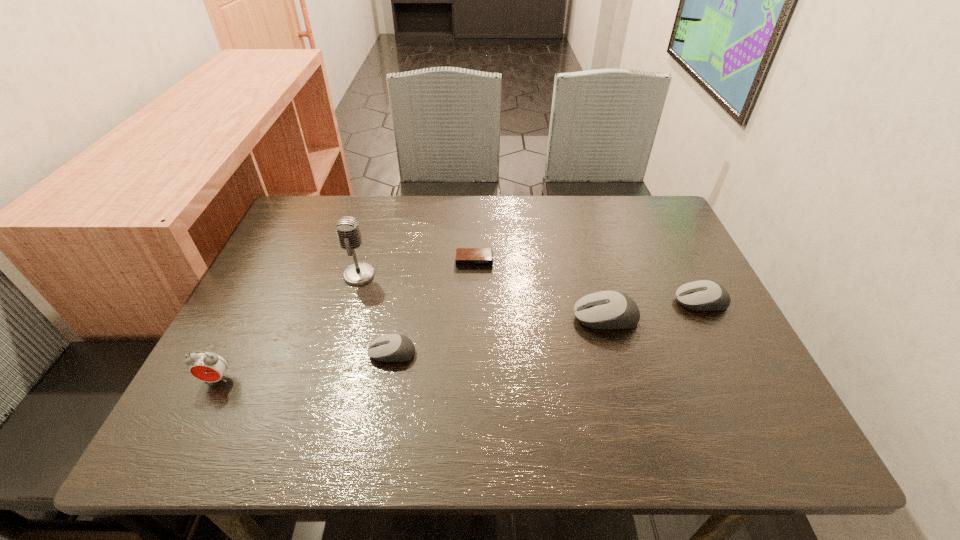
Find the location of a particular element. Image resolution: width=960 pixels, height=540 pixels. free region that satisfies the following two spatial constraints: 1. on the wheel side of the fourth tallest object; 2. on the face of the nearest object is located at coordinates (740, 379).

At what (x,y) coordinates should I click in order to perform the action: click on vacant area that satisfies the following two spatial constraints: 1. on the wheel side of the third tallest object; 2. on the face of the leftmost object. Please return your answer as a coordinate pair (x, y). Looking at the image, I should click on (622, 379).